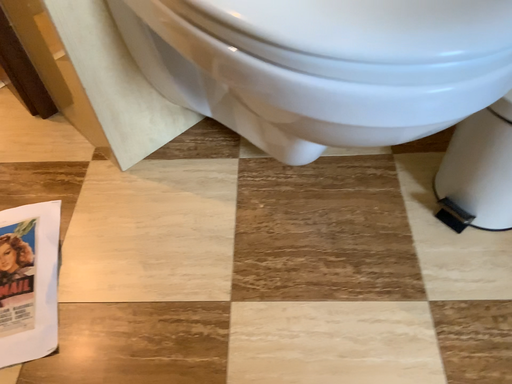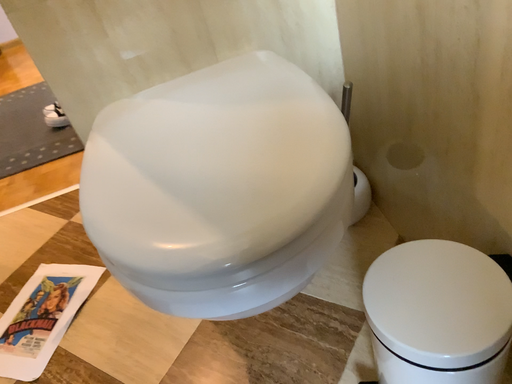
Question: Which way did the camera rotate in the video?

Choices:
 (A) rotated downward
 (B) rotated upward

Answer: (B)